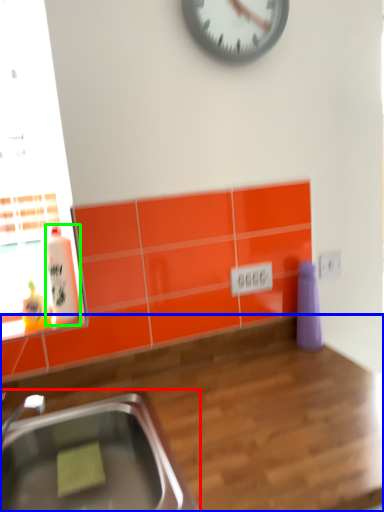
Question: Which is nearer to the sink (highlighted by a red box)? countertop (highlighted by a blue box) or bottle (highlighted by a green box).

Choices:
 (A) countertop
 (B) bottle

Answer: (A)